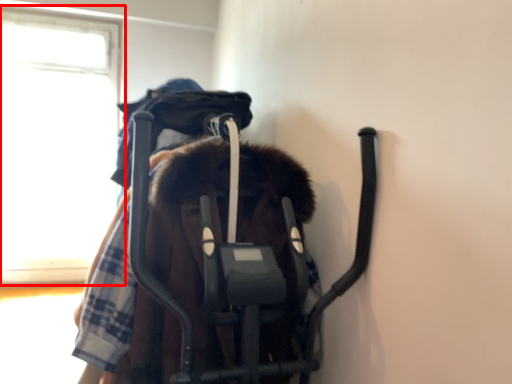
Question: Considering the relative positions of window (annotated by the red box) and baby elephant in the image provided, where is window (annotated by the red box) located with respect to the staircase?

Choices:
 (A) left
 (B) right

Answer: (A)